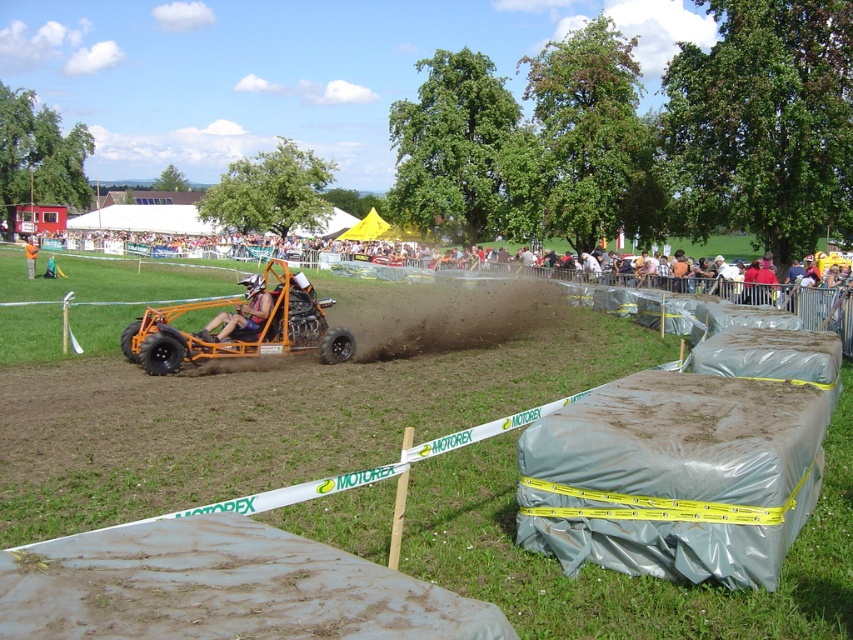
Is point (824, 604) in front of point (27, 257)?

That is True.

Which is above, gray plastic barrier at center or orange fabric person at center?

orange fabric person at center is above.

Who is more forward, (641, 588) or (35, 252)?

Point (641, 588) is more forward.

Image resolution: width=853 pixels, height=640 pixels. I want to click on gray plastic barrier at center, so click(254, 394).

Can you confirm if gray plastic barrier at center is wider than orange metallic go-kart at center?

No.

Which is in front, point (108, 371) or point (791, 296)?

Point (108, 371) is more forward.

The width and height of the screenshot is (853, 640). Find the location of `gray plastic barrier at center`. gray plastic barrier at center is located at coordinates pos(254,394).

From the picture: Is gray plastic barrier at center taller than orange matte/rough monster truck at center?

Yes, gray plastic barrier at center is taller than orange matte/rough monster truck at center.

Is point (566, 596) farther from camera compared to point (339, 336)?

No, (566, 596) is in front of (339, 336).

Where is `gray plastic barrier at center`? This screenshot has height=640, width=853. gray plastic barrier at center is located at coordinates (254, 394).